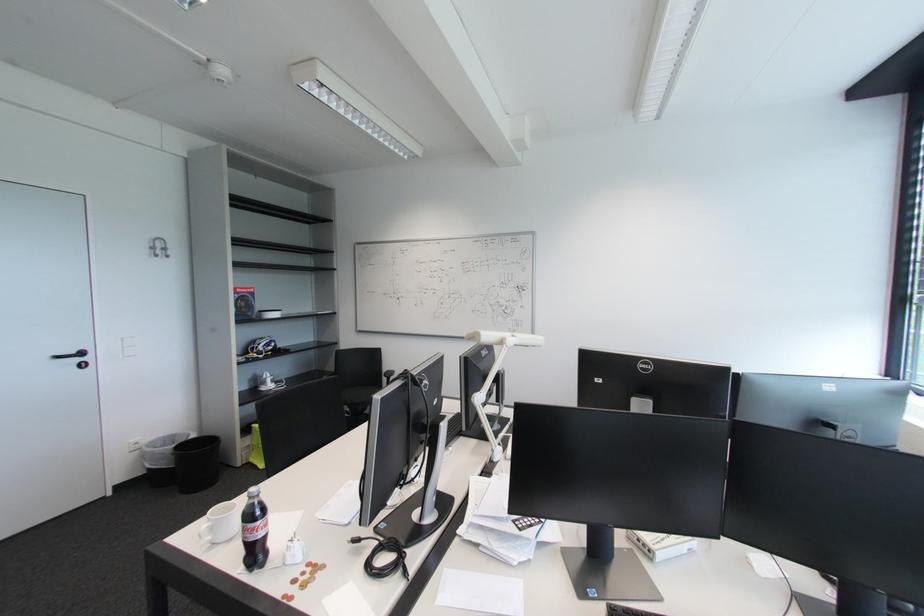
This screenshot has height=616, width=924. What do you see at coordinates (492, 407) in the screenshot?
I see `a white power adapter` at bounding box center [492, 407].